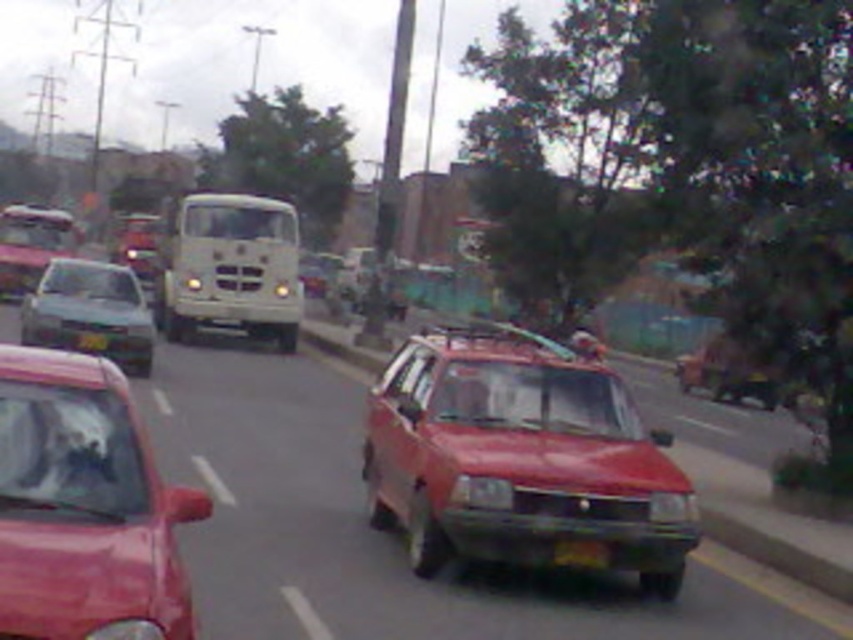
Question: Is shiny red car at center thinner than black plastic license plate at center?

Choices:
 (A) no
 (B) yes

Answer: (B)

Question: Which object is farther from the camera taking this photo?

Choices:
 (A) matte red car at left
 (B) matte gray sedan at left

Answer: (B)

Question: Which of the following is the closest to the observer?

Choices:
 (A) black plastic license plate at center
 (B) matte gray sedan at left
 (C) matte red car at left
 (D) shiny red car at center

Answer: (C)

Question: Does shiny red car at center lie in front of matte red car at left?

Choices:
 (A) yes
 (B) no

Answer: (B)

Question: Estimate the real-world distances between objects in this image. Which object is closer to the shiny red car at center?

Choices:
 (A) matte gray sedan at left
 (B) matte red car at left

Answer: (B)

Question: Can you confirm if matte red car at left is positioned below matte gray sedan at left?

Choices:
 (A) no
 (B) yes

Answer: (B)